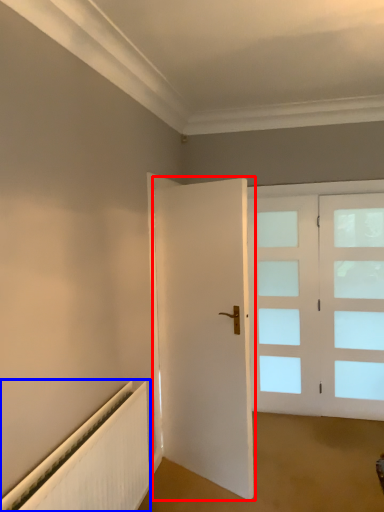
Question: Which point is closer to the camera, door (highlighted by a red box) or radiator (highlighted by a blue box)?

Choices:
 (A) door
 (B) radiator

Answer: (B)